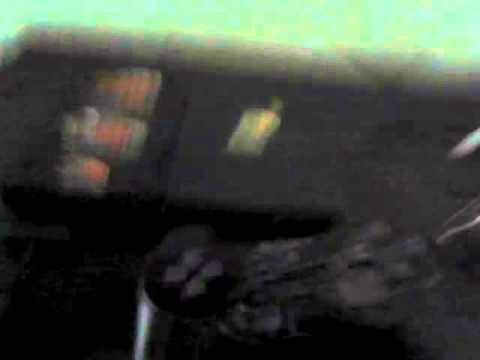
Locate an element on the screen. The height and width of the screenshot is (360, 480). light area possibly from a monitor is located at coordinates (431, 36), (339, 39).